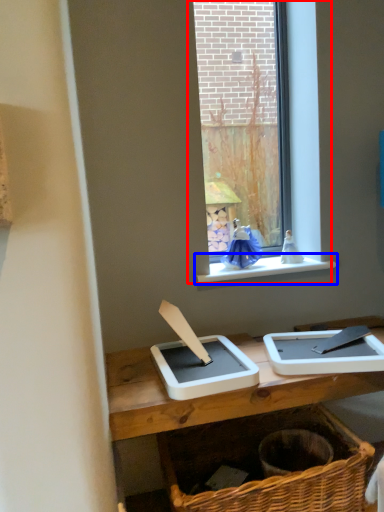
Question: Among these objects, which one is farthest to the camera, window (highlighted by a red box) or window sill (highlighted by a blue box)?

Choices:
 (A) window
 (B) window sill

Answer: (A)